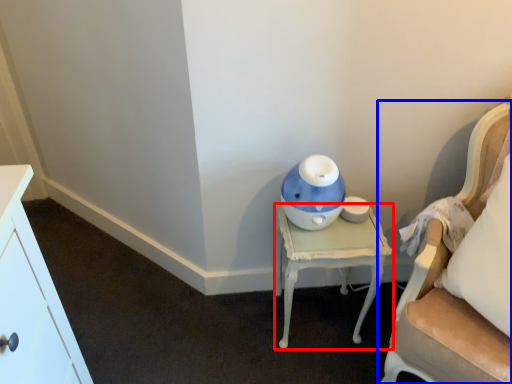
Question: Among these objects, which one is nearest to the camera, nightstand (highlighted by a red box) or chair (highlighted by a blue box)?

Choices:
 (A) nightstand
 (B) chair

Answer: (B)